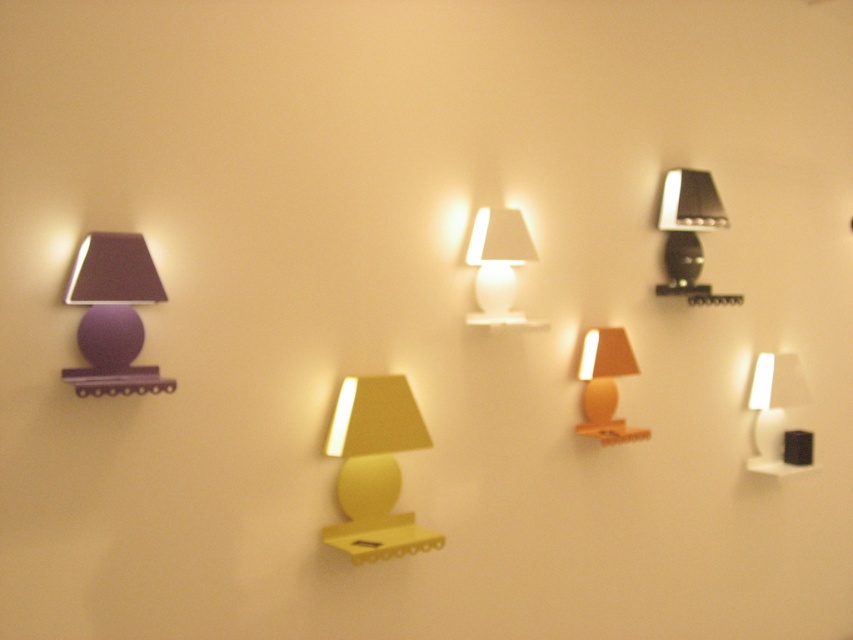
You are standing in front of the wall lamp display and want to take a photo of the metallic silver lamp at upper right with your camera. If your camera can focus on objects up to 3 meters away, will you be able to capture a clear photo?

The metallic silver lamp at upper right and camera are 2.70 meters apart, so yes, the camera can focus on the lamp since the distance is within its 3 meters range.

You are standing in front of the wall display and want to reach a point that is closer to you. Which point should you aim for, point (393, 490) or point (482, 236)?

Point (393, 490) is in front of point (482, 236), so you should aim for point (393, 490) as it is closer to you.

You are standing in front of the wall lamp display and want to touch both points mentioned. Which point should you reach for first, the point at coordinate [714,189] or the point at [589,385]?

You should reach for point [714,189] first because it is closer to you than point [589,385].